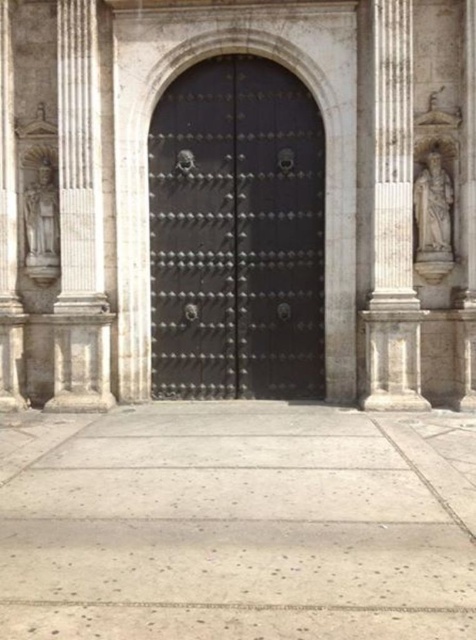
Between white marble statue at right and polished stone statue at left, which one is positioned higher?

white marble statue at right is above.

Is point (415, 196) more distant than point (27, 214)?

No.

Which is behind, point (424, 230) or point (49, 216)?

Positioned behind is point (49, 216).

At what (x,y) coordinates should I click in order to perform the action: click on white marble statue at right. Please return your answer as a coordinate pair (x, y). Image resolution: width=476 pixels, height=640 pixels. Looking at the image, I should click on coord(433,209).

Is point (188, 93) closer to camera compared to point (426, 193)?

No, (188, 93) is further to viewer.

Who is shorter, polished metal door at center or white marble statue at right?

With less height is white marble statue at right.

Between point (288, 211) and point (445, 246), which one is positioned behind?

Point (288, 211)

You are a GUI agent. You are given a task and a screenshot of the screen. Output one action in this format:
    pyautogui.click(x=<x>, y=<y>)
    Task: Click on the polished metal door at center
    
    Given the screenshot: What is the action you would take?
    pyautogui.click(x=237, y=234)

Locate an element on the screen. polished metal door at center is located at coordinates (237, 234).

Describe the element at coordinates (237, 234) in the screenshot. This screenshot has height=640, width=476. I see `polished metal door at center` at that location.

Which is behind, point (307, 321) or point (25, 196)?

Point (307, 321)

Where is `polished metal door at center`? Image resolution: width=476 pixels, height=640 pixels. polished metal door at center is located at coordinates click(237, 234).